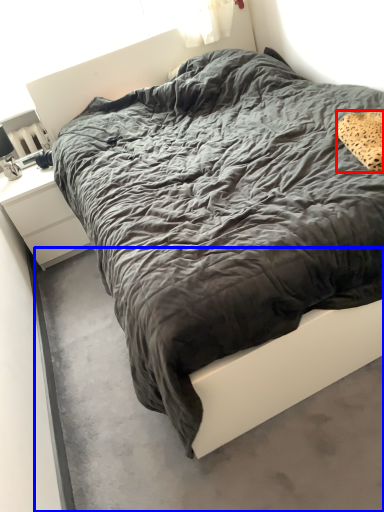
Question: Which of the following is the closest to the observer, pillow (highlighted by a red box) or concrete (highlighted by a blue box)?

Choices:
 (A) pillow
 (B) concrete

Answer: (B)